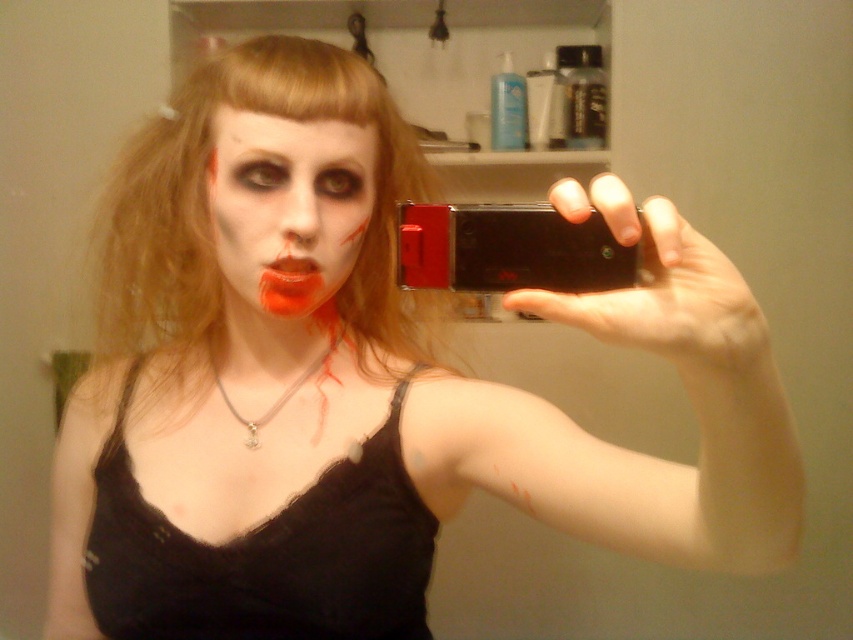
Does point (115, 595) come behind point (310, 240)?

Yes.

Who is shorter, black lace dress at center or matte black face at center?

Standing shorter between the two is matte black face at center.

The height and width of the screenshot is (640, 853). What do you see at coordinates (267, 554) in the screenshot?
I see `black lace dress at center` at bounding box center [267, 554].

Find the location of a particular element. black lace dress at center is located at coordinates (267, 554).

Between black lace dress at center and silver metallic necklace at center, which one is positioned lower?

black lace dress at center is lower down.

The width and height of the screenshot is (853, 640). What do you see at coordinates (267, 554) in the screenshot?
I see `black lace dress at center` at bounding box center [267, 554].

Find the location of a particular element. black lace dress at center is located at coordinates (267, 554).

The width and height of the screenshot is (853, 640). Describe the element at coordinates (267, 554) in the screenshot. I see `black lace dress at center` at that location.

You are a GUI agent. You are given a task and a screenshot of the screen. Output one action in this format:
    pyautogui.click(x=<x>, y=<y>)
    Task: Click on the black lace dress at center
    
    Given the screenshot: What is the action you would take?
    pyautogui.click(x=267, y=554)